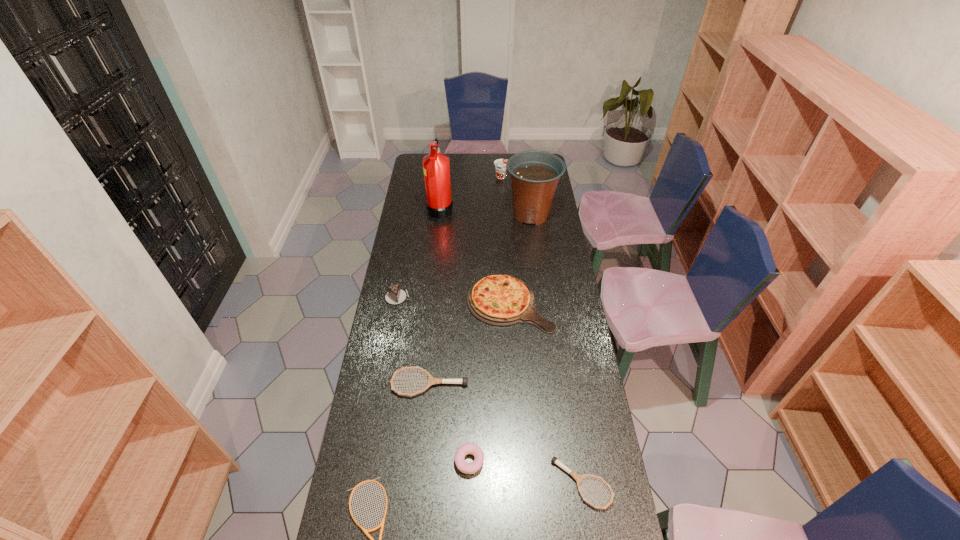
Identify the location of free spot at the right edge of the desktop. This screenshot has width=960, height=540. (578, 346).

Locate an element on the screen. The width and height of the screenshot is (960, 540). empty space that is in between the red fire extinguisher and the flowerpot is located at coordinates (486, 211).

Locate an element on the screen. free spot between the red pizza and the eighth tallest object is located at coordinates (545, 393).

Find the location of a particular element. The height and width of the screenshot is (540, 960). vacant region between the smaller gray tennis racket and the pizza is located at coordinates (545, 393).

In order to click on free space between the red pizza and the farthest object in this screenshot , I will do `click(506, 240)`.

This screenshot has width=960, height=540. I want to click on the third closest object relative to the chocolate cake, so click(439, 204).

The image size is (960, 540). In order to click on the sixth closest object to the farthest tennis racket in this screenshot , I will do (x=534, y=174).

Locate an element on the screen. tennis racket that is the closest to the tallest object is located at coordinates (431, 380).

You are a GUI agent. You are given a task and a screenshot of the screen. Output one action in this format:
    pyautogui.click(x=<x>, y=<y>)
    Task: Click on the tennis racket that is the second closest to the fire extinguisher
    Image resolution: width=960 pixels, height=540 pixels.
    Given the screenshot: What is the action you would take?
    pyautogui.click(x=577, y=477)

Locate an element on the screen. Image resolution: width=960 pixels, height=540 pixels. vacant area in the image that satisfies the following two spatial constraints: 1. at the spray nozzle of the pizza; 2. on the left side of the fire extinguisher is located at coordinates 430,303.